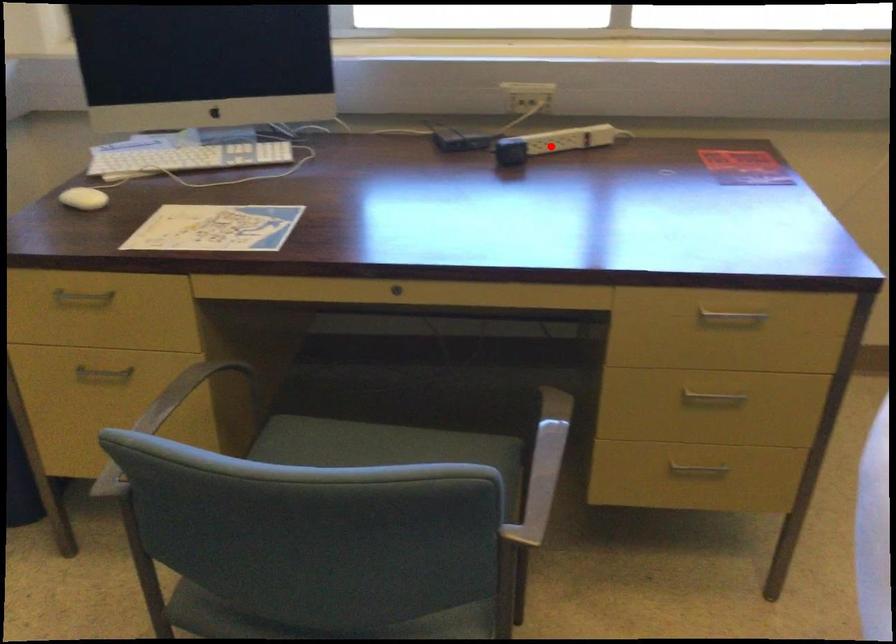
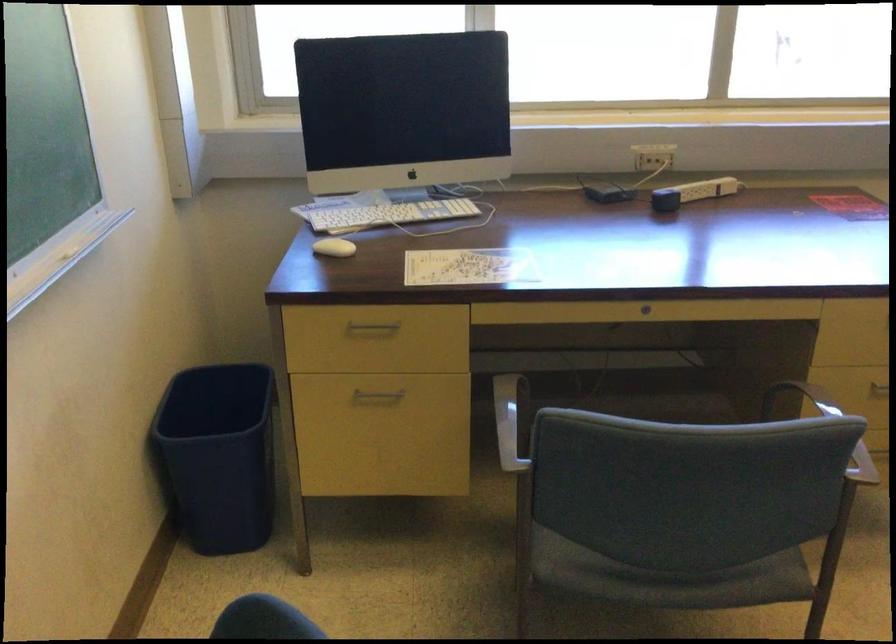
Question: A red point is marked in image1. In image2, is the corresponding 3D point closer to the camera or farther? Reply with the corresponding letter.

Choices:
 (A) The corresponding 3D point is closer.
 (B) The corresponding 3D point is farther.

Answer: (B)